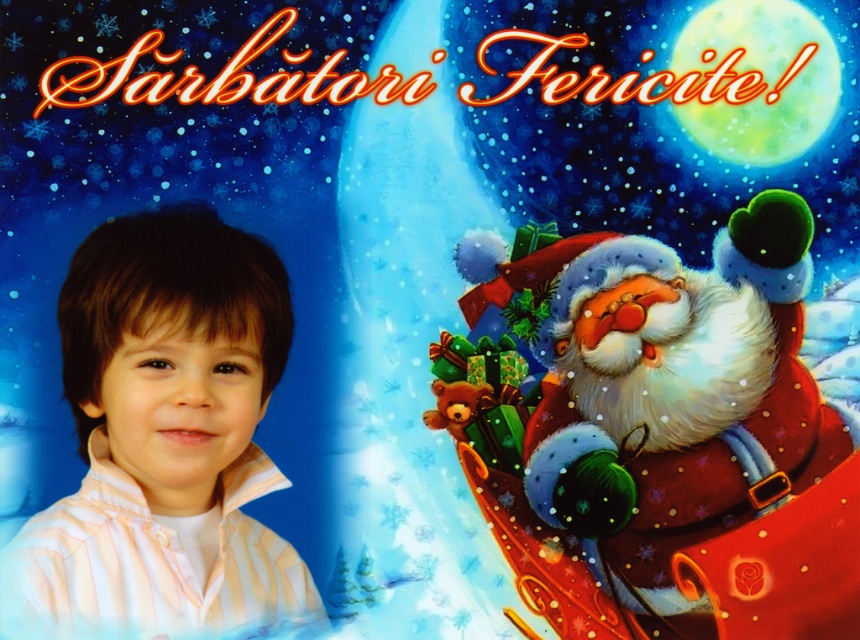
Between fuzzy red santa at right and striped cotton shirt at left, which one is positioned higher?

striped cotton shirt at left is higher up.

Can you confirm if fuzzy red santa at right is thinner than striped cotton shirt at left?

Incorrect, fuzzy red santa at right's width is not less than striped cotton shirt at left's.

The image size is (860, 640). What are the coordinates of `fuzzy red santa at right` in the screenshot? It's located at pos(661,429).